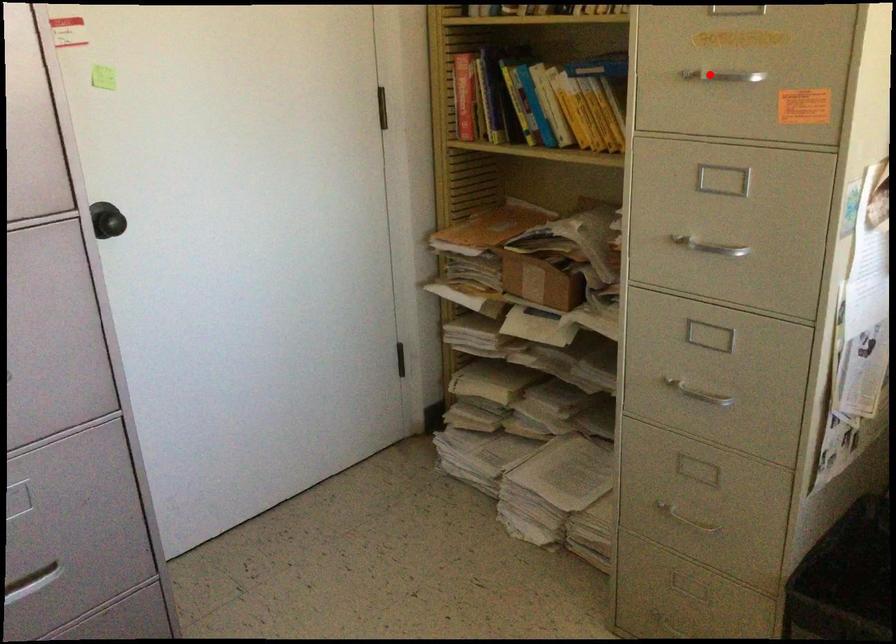
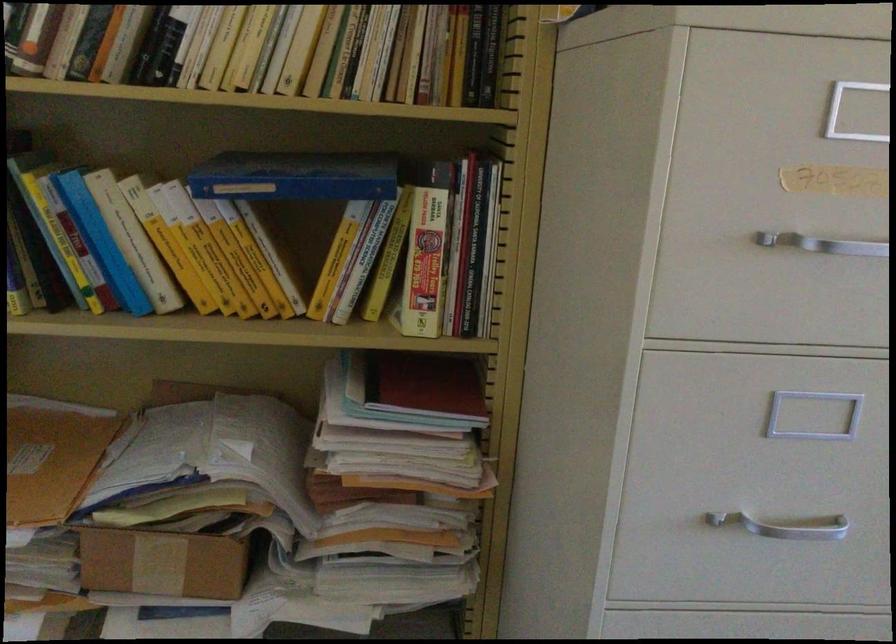
Question: I am providing you with two images of the same scene from different viewpoints. Given a red point in image1, look at the same physical point in image2. Is it:

Choices:
 (A) Closer to the viewpoint
 (B) Farther from the viewpoint

Answer: (A)